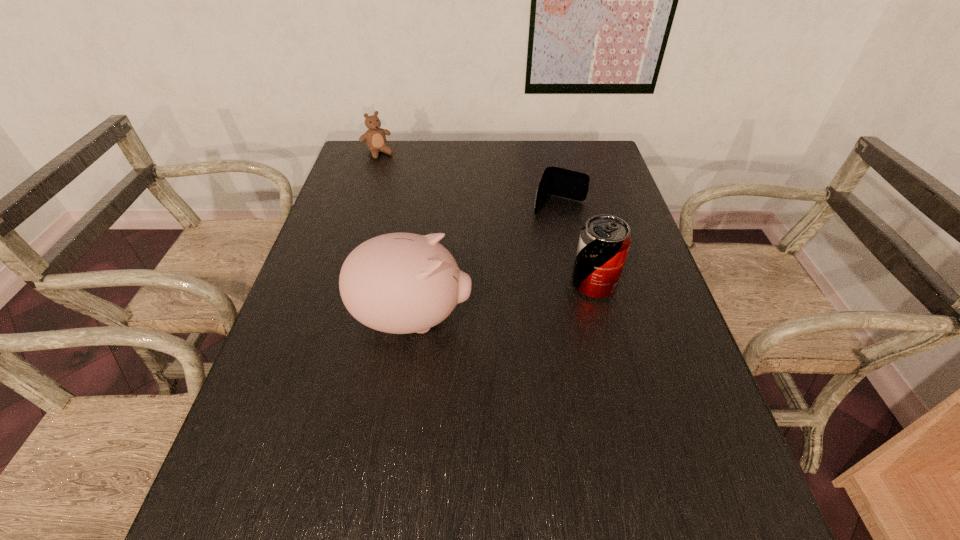
This screenshot has height=540, width=960. I want to click on object that is positioned at the far left corner, so [375, 139].

I want to click on free region at the far edge of the desktop, so click(x=530, y=163).

Where is `free region at the near edge of the desktop`? The width and height of the screenshot is (960, 540). free region at the near edge of the desktop is located at coordinates (439, 442).

In the image, there is a desktop. In order to click on vacant region at the left edge in this screenshot , I will do [x=288, y=329].

Find the location of `vacant space at the right edge of the desktop`. vacant space at the right edge of the desktop is located at coordinates 649,401.

Image resolution: width=960 pixels, height=540 pixels. I want to click on vacant region at the far left corner of the desktop, so click(x=358, y=150).

Where is `free space at the far right corner of the desktop`? This screenshot has width=960, height=540. free space at the far right corner of the desktop is located at coordinates tap(566, 164).

At what (x,y) coordinates should I click in order to perform the action: click on vacant space in between the farthest object and the wallet. Please return your answer as a coordinate pair (x, y). The image size is (960, 540). Looking at the image, I should click on (468, 179).

This screenshot has width=960, height=540. What are the coordinates of `free space between the second tallest object and the tallest object` in the screenshot? It's located at (503, 301).

Image resolution: width=960 pixels, height=540 pixels. I want to click on blank region between the second object from left to right and the second tallest object, so click(503, 301).